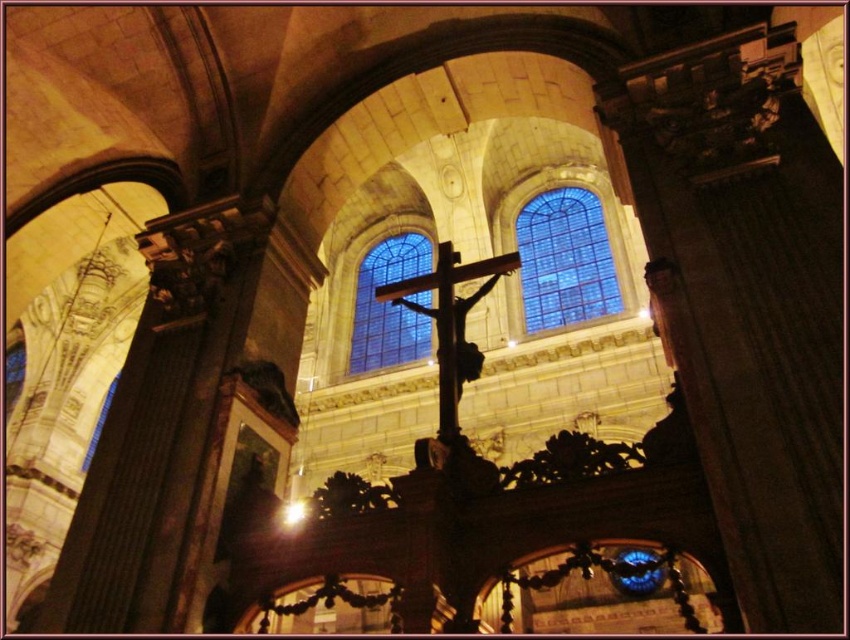
Does blue stained glass at upper center have a smaller size compared to metallic gold crucifix at center?

Indeed, blue stained glass at upper center has a smaller size compared to metallic gold crucifix at center.

The image size is (850, 640). What do you see at coordinates (564, 259) in the screenshot?
I see `blue stained glass at upper center` at bounding box center [564, 259].

This screenshot has width=850, height=640. What do you see at coordinates (564, 259) in the screenshot?
I see `blue stained glass at upper center` at bounding box center [564, 259].

This screenshot has width=850, height=640. Find the location of `blue stained glass at upper center`. blue stained glass at upper center is located at coordinates (564, 259).

Who is higher up, blue glass window at center or metallic gold crucifix at center?

blue glass window at center is higher up.

In the scene shown: Is blue glass window at center thinner than metallic gold crucifix at center?

Yes, blue glass window at center is thinner than metallic gold crucifix at center.

Is point (384, 340) less distant than point (472, 342)?

No, it is behind (472, 342).

The image size is (850, 640). I want to click on blue glass window at center, so click(x=388, y=305).

Does blue stained glass at upper center have a greater height compared to blue glass window at center?

Yes, blue stained glass at upper center is taller than blue glass window at center.

This screenshot has width=850, height=640. Find the location of `blue stained glass at upper center`. blue stained glass at upper center is located at coordinates (564, 259).

Find the location of a particular element. The width and height of the screenshot is (850, 640). blue stained glass at upper center is located at coordinates (564, 259).